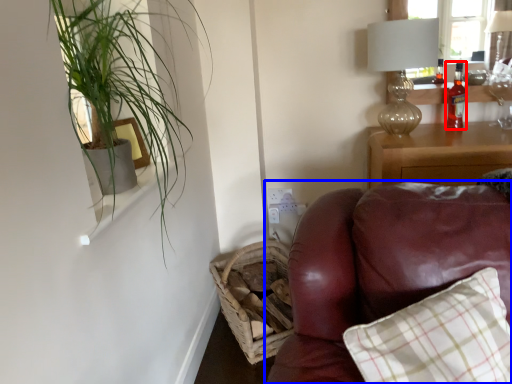
Question: Which object appears closest to the camera in this image, bottle (highlighted by a red box) or studio couch (highlighted by a blue box)?

Choices:
 (A) bottle
 (B) studio couch

Answer: (B)